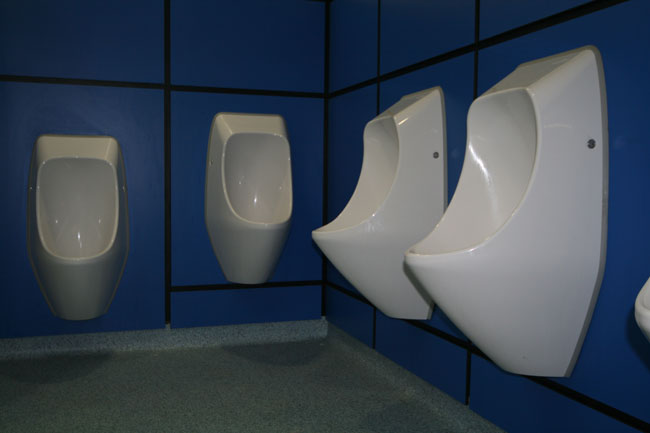
Where is `top of urinal`? This screenshot has height=433, width=650. top of urinal is located at coordinates (532, 67), (409, 94), (253, 122), (73, 145).